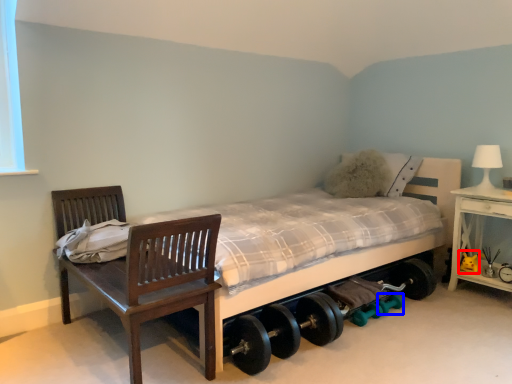
Question: Which object appears farthest to the camera in this image, toy (highlighted by a red box) or dumbbell (highlighted by a blue box)?

Choices:
 (A) toy
 (B) dumbbell

Answer: (A)